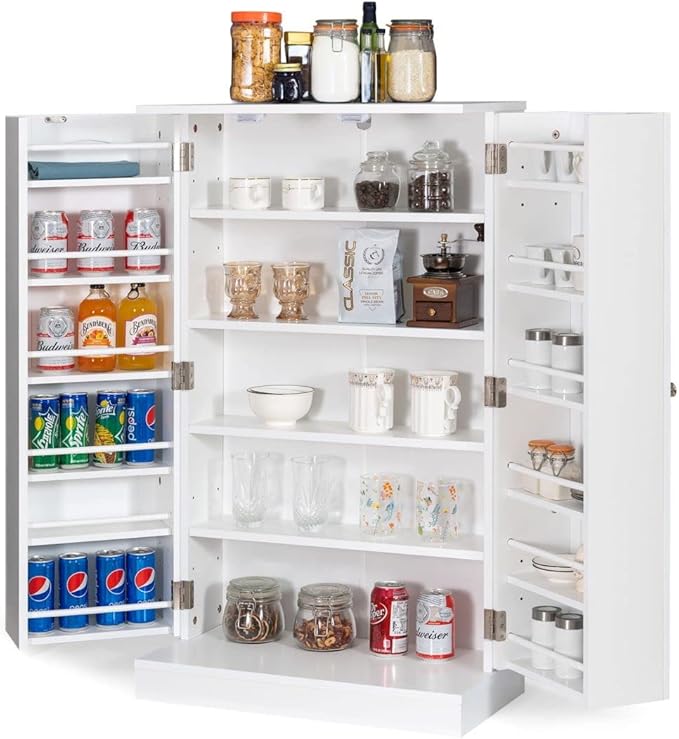
Find the location of a particular element. Image resolution: width=679 pixels, height=739 pixels. jars is located at coordinates (246, 44), (287, 77), (340, 63), (411, 67), (371, 183), (435, 180).